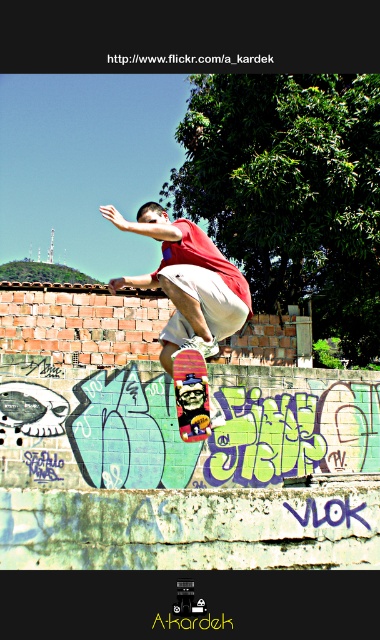
You are a photographer capturing the skateboarder midair. The matte red skateboard at center is crucial for the shot. Where should you focus your camera to ensure the skateboard is in the frame?

The matte red skateboard at center is located at point 2D coordinates of (x=178, y=262), so you should focus your camera at that coordinate to ensure the skateboard is in the frame.

You are a photographer trying to capture the skateboarder and their board. You notice two skateboards in the scene. Which skateboard is closer to the camera, the matte red skateboard at center or the multicolored wooden skateboard at center?

The matte red skateboard at center is closer to the camera because the multicolored wooden skateboard at center is behind it.

You are a photographer trying to capture the skateboarder in the center of the image. The scene has a point at coordinates (x=178, y=262). What object is located at this point?

The point at coordinates (x=178, y=262) indicates the location of the matte red skateboard at center.